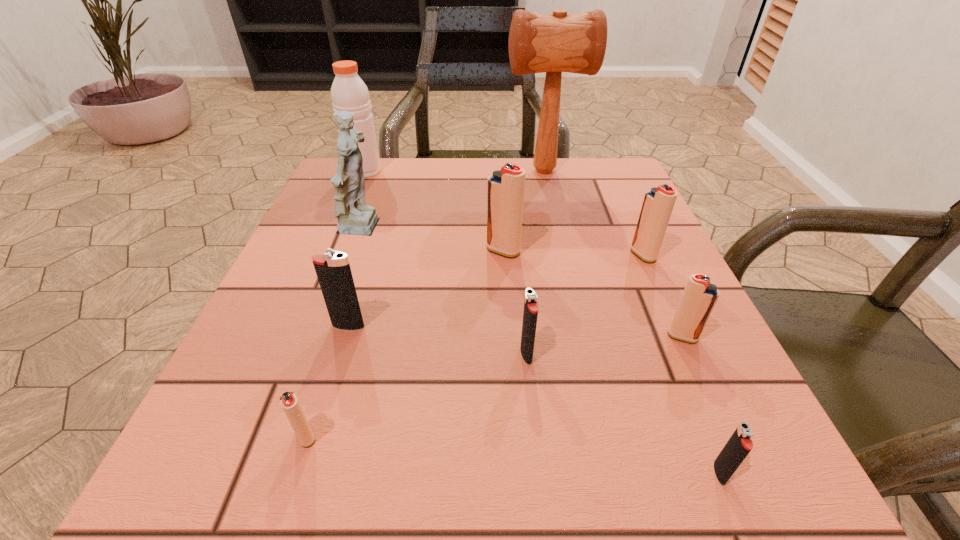
Locate an element on the screen. This screenshot has height=540, width=960. vacant region at the far left corner of the desktop is located at coordinates pyautogui.click(x=388, y=172).

The width and height of the screenshot is (960, 540). What are the coordinates of `free region at the far right corner of the desktop` in the screenshot? It's located at (609, 163).

The width and height of the screenshot is (960, 540). What are the coordinates of `unoccupied position between the figurine and the nearest black igniter` in the screenshot? It's located at (541, 351).

Locate an element on the screen. vacant area that lies between the mallet and the figurine is located at coordinates (453, 200).

Where is `vacant space that is in between the third biggest red igniter and the farthest black igniter`? Image resolution: width=960 pixels, height=540 pixels. vacant space that is in between the third biggest red igniter and the farthest black igniter is located at coordinates (516, 332).

I want to click on free space between the second smallest red igniter and the biggest red igniter, so click(x=592, y=294).

The image size is (960, 540). I want to click on unoccupied position between the third farthest red igniter and the figurine, so click(x=523, y=283).

The height and width of the screenshot is (540, 960). What are the coordinates of `free space between the sixth farthest igniter and the tallest igniter` in the screenshot? It's located at [404, 343].

Locate an element on the screen. vacant area that lies between the tallest object and the figurine is located at coordinates (453, 200).

Identify the location of unoccupied position between the biggest red igniter and the orange shaker. (434, 211).